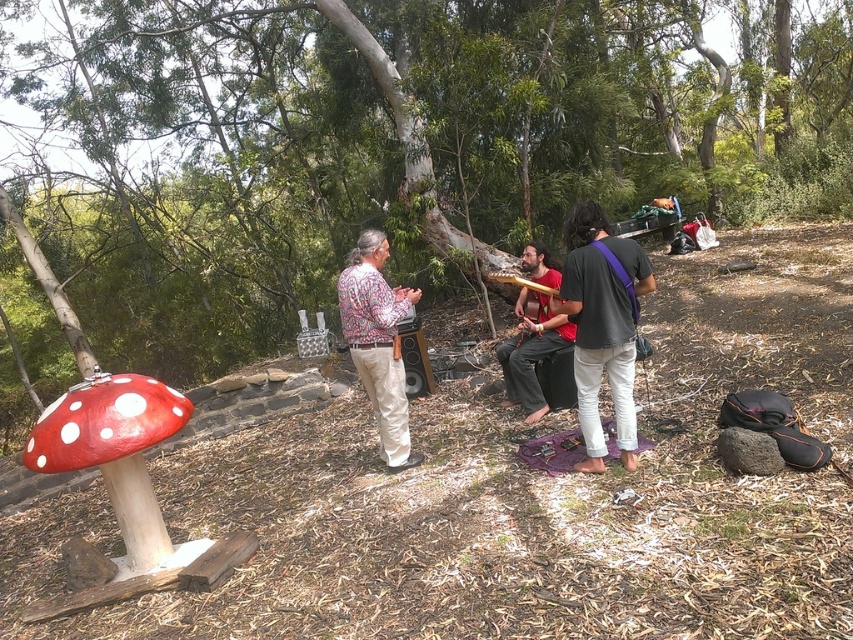
You are standing at the origin point in the image. You want to walk to the smooth bark tree at center. What are the coordinates of the direction you should walk towards?

The coordinates of the direction you should walk towards are point [374,150].